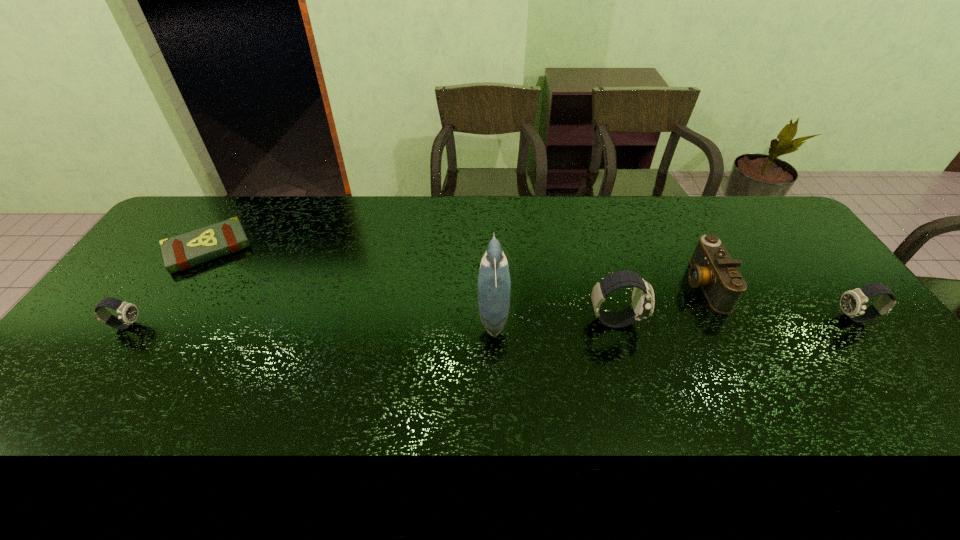
Locate an element on the screen. The image size is (960, 540). vacant area situated 0.200m on the face of the leftmost watch is located at coordinates (214, 325).

Find the location of `vacant space located on the face of the fifth shortest object`. vacant space located on the face of the fifth shortest object is located at coordinates (727, 321).

This screenshot has width=960, height=540. Identify the location of vacant point located 0.350m on the face of the second shortest watch. (711, 319).

The image size is (960, 540). In order to click on free point located 0.230m on the face of the second shortest watch in this screenshot , I will do `click(755, 319)`.

You are a GUI agent. You are given a task and a screenshot of the screen. Output one action in this format:
    pyautogui.click(x=<x>, y=<y>)
    Task: Click on the free space located on the face of the second shortest watch
    This screenshot has height=540, width=960.
    Given the screenshot: What is the action you would take?
    pyautogui.click(x=804, y=319)

The height and width of the screenshot is (540, 960). In order to click on vacant space located 0.170m on the right of the book in this screenshot , I will do `click(302, 248)`.

Where is `blank space located 0.180m on the lens of the camera`? This screenshot has height=540, width=960. blank space located 0.180m on the lens of the camera is located at coordinates (625, 285).

Where is `vacant space located 0.270m on the lens of the camera`? The height and width of the screenshot is (540, 960). vacant space located 0.270m on the lens of the camera is located at coordinates (595, 285).

Find the location of a particular element. This screenshot has height=540, width=960. free location located 0.250m on the lens of the camera is located at coordinates pos(602,285).

Locate an element on the screen. free region located 0.160m at the tip of the bird's beak is located at coordinates (421, 314).